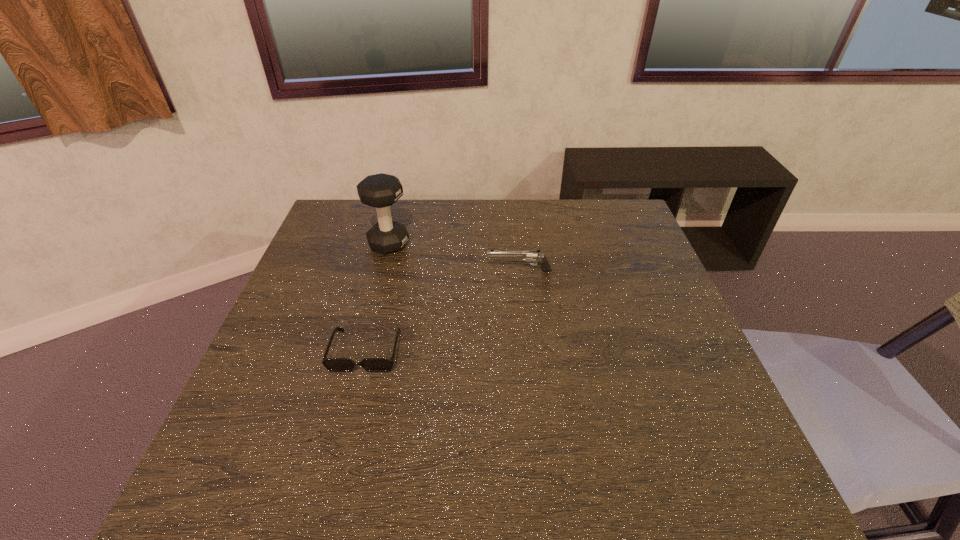
You are a GUI agent. You are given a task and a screenshot of the screen. Output one action in this format:
    pyautogui.click(x=<x>, y=<y>)
    Task: Click on the tallest object
    Image resolution: width=960 pixels, height=540 pixels.
    Given the screenshot: What is the action you would take?
    pyautogui.click(x=381, y=190)

What are the coordinates of `dumbbell` in the screenshot? It's located at (381, 190).

Find the location of a particular element. The width and height of the screenshot is (960, 540). the rightmost object is located at coordinates click(528, 255).

What are the coordinates of `the second shortest object` in the screenshot? It's located at (528, 255).

The width and height of the screenshot is (960, 540). I want to click on the nearest object, so click(331, 364).

You are a GUI agent. You are given a task and a screenshot of the screen. Output one action in this format:
    pyautogui.click(x=<x>, y=<y>)
    Task: Click on the shortest object
    The image size is (960, 540).
    Given the screenshot: What is the action you would take?
    pyautogui.click(x=331, y=364)

This screenshot has width=960, height=540. What are the coordinates of `free space located 0.080m on the right of the dumbbell` in the screenshot? It's located at (436, 244).

I want to click on vacant space located 0.340m on the front-facing side of the second tallest object, so click(365, 271).

Image resolution: width=960 pixels, height=540 pixels. I want to click on blank space located 0.300m on the front-facing side of the second tallest object, so click(x=379, y=271).

Identify the location of free space located 0.390m on the front-facing side of the second tallest object. (347, 271).